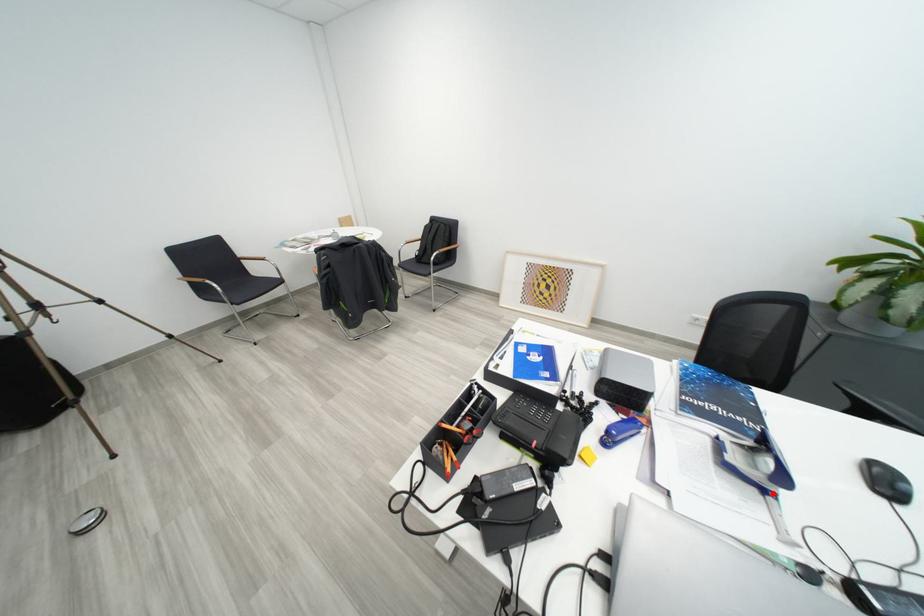
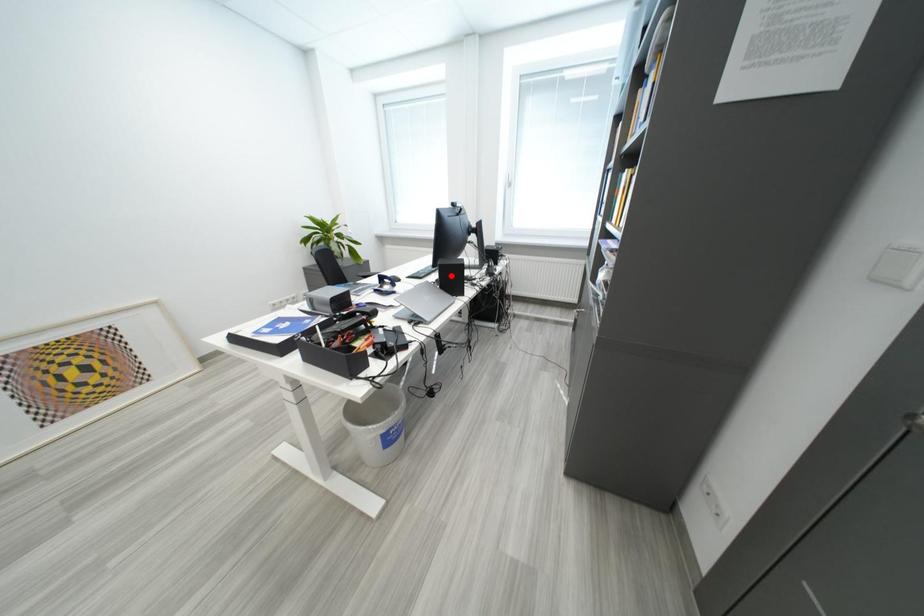
I am providing you with two images of the same scene from different viewpoints. A red point is marked on the first image and another point is marked on the second image. Do the highlighted points in image1 and image2 indicate the same real-world spot?

No